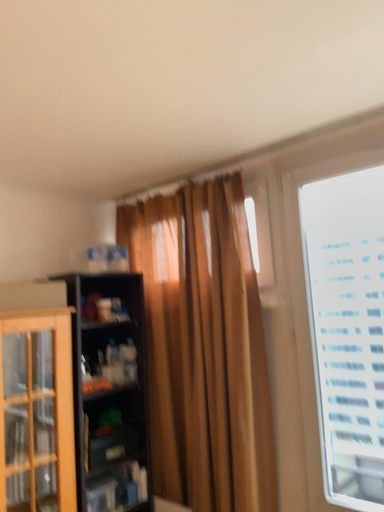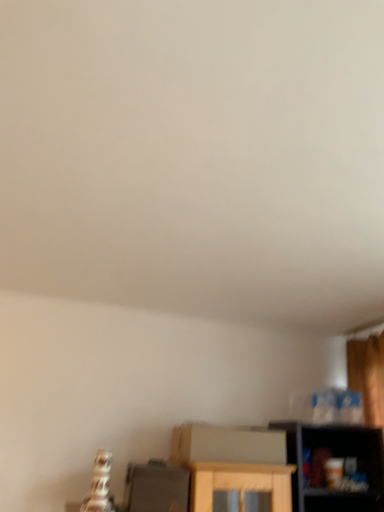
Question: Which way did the camera rotate in the video?

Choices:
 (A) rotated right
 (B) rotated left

Answer: (B)